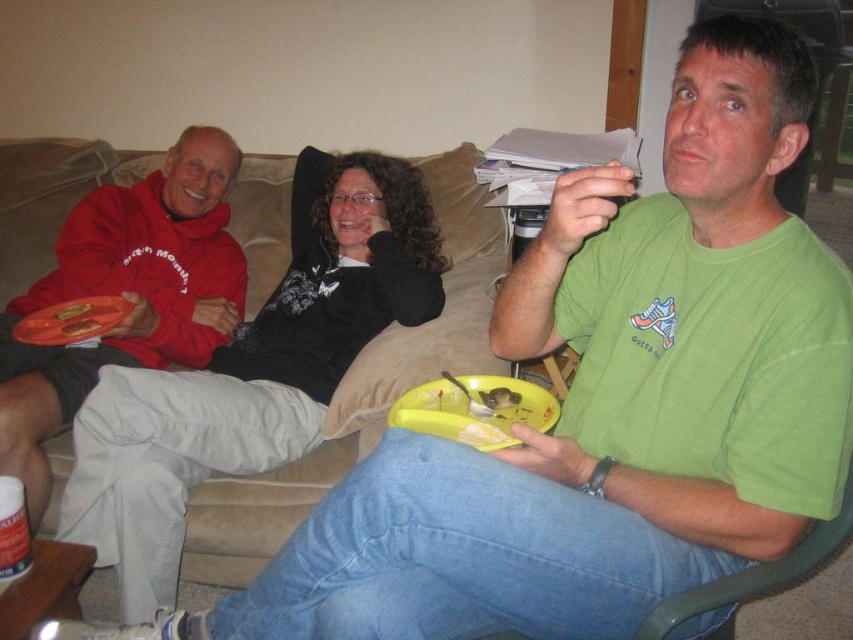
Between point (94, 262) and point (67, 305), which one is positioned in front?

Point (67, 305)

In the scene shown: Can you confirm if matte red hoodie at left is positioned to the right of matte plastic snack at center?

→ Correct, you'll find matte red hoodie at left to the right of matte plastic snack at center.

The image size is (853, 640). I want to click on matte red hoodie at left, so click(x=126, y=296).

Measure the distance between matte red hoodie at left and camera.

4.94 feet

Is point (207, 211) farther from camera compared to point (93, 333)?

Yes, point (207, 211) is behind point (93, 333).

I want to click on matte red hoodie at left, so click(126, 296).

Which is behind, point (372, 296) or point (79, 326)?

The point (372, 296) is more distant.

Describe the element at coordinates (252, 371) in the screenshot. The image size is (853, 640). I see `black matte sweater at upper center` at that location.

From the picture: Who is more forward, (206, 456) or (65, 332)?

Point (206, 456)

Where is `black matte sweater at upper center`? The height and width of the screenshot is (640, 853). black matte sweater at upper center is located at coordinates (252, 371).